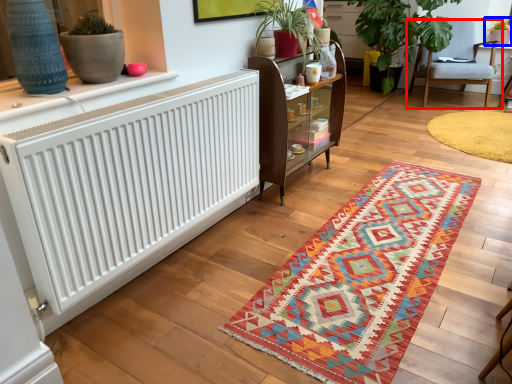
Question: Which object appears closest to the camera in this image, chair (highlighted by a red box) or houseplant (highlighted by a blue box)?

Choices:
 (A) chair
 (B) houseplant

Answer: (A)